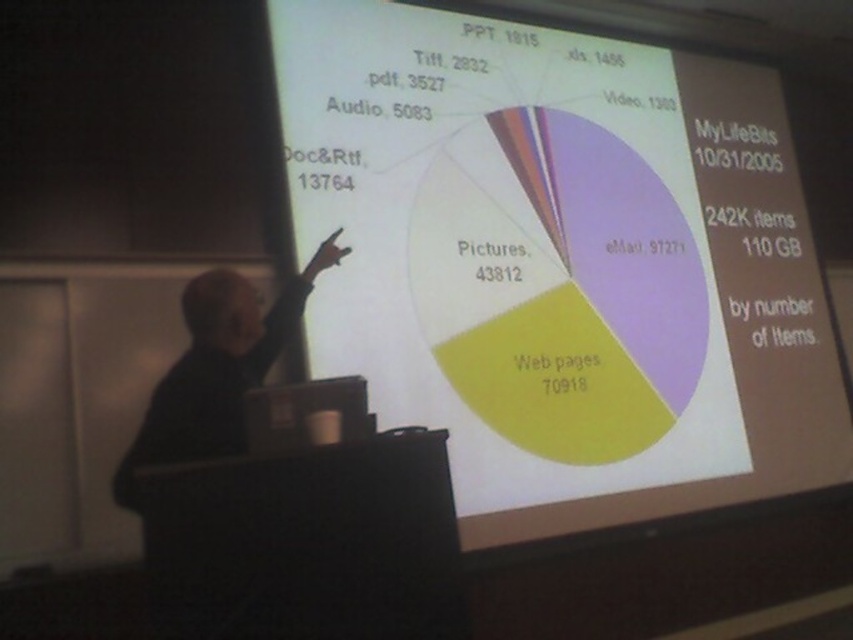
Question: Among these objects, which one is farthest from the camera?

Choices:
 (A) white paper at center
 (B) black fabric at left

Answer: (A)

Question: Can you confirm if white paper at center is wider than black fabric at left?

Choices:
 (A) no
 (B) yes

Answer: (B)

Question: Is white paper at center further to camera compared to black fabric at left?

Choices:
 (A) no
 (B) yes

Answer: (B)

Question: Where is white paper at center located in relation to black fabric at left in the image?

Choices:
 (A) left
 (B) right

Answer: (B)

Question: Which of the following is the farthest from the observer?

Choices:
 (A) coord(184,317)
 (B) coord(440,182)

Answer: (B)